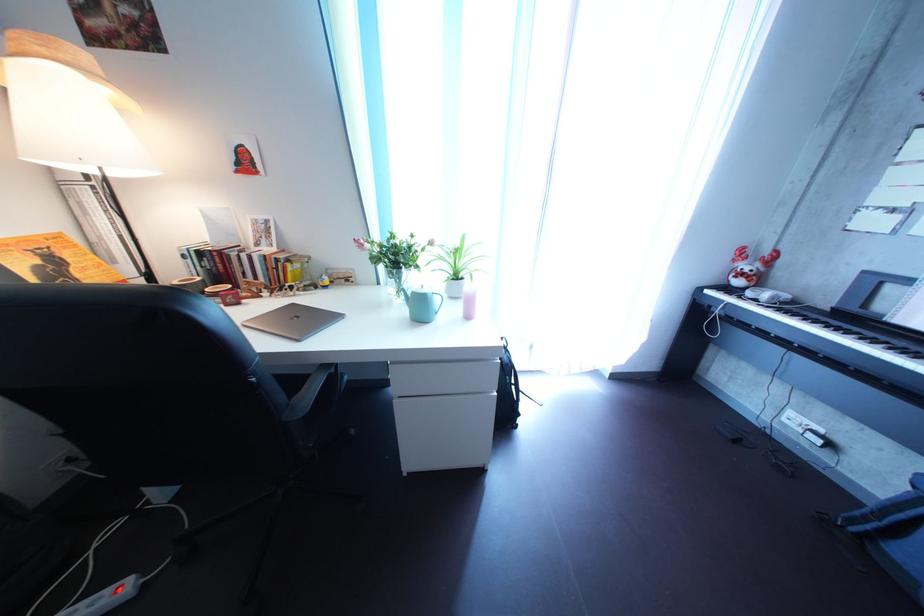
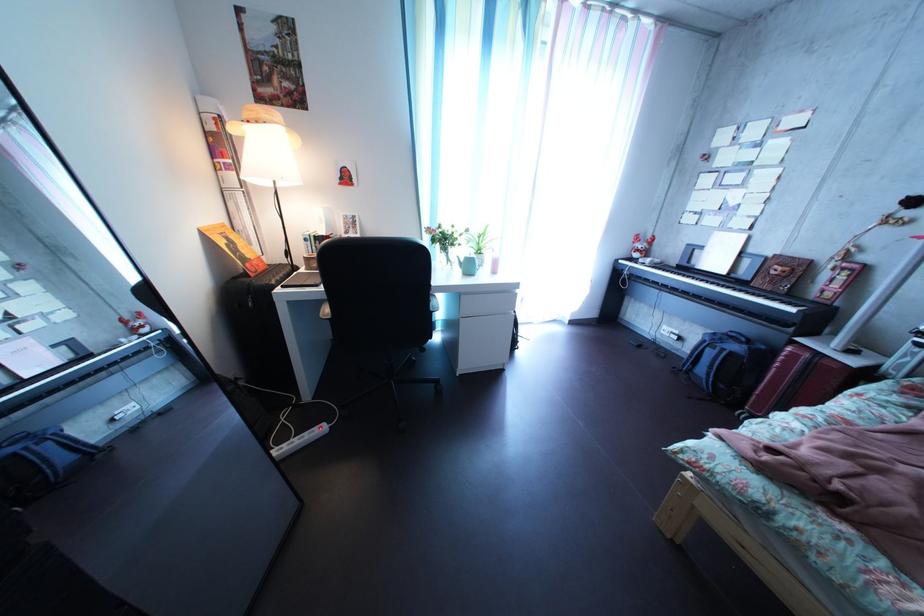
Question: How did the camera likely rotate?

Choices:
 (A) Left
 (B) Right
 (C) Up
 (D) Down

Answer: (B)